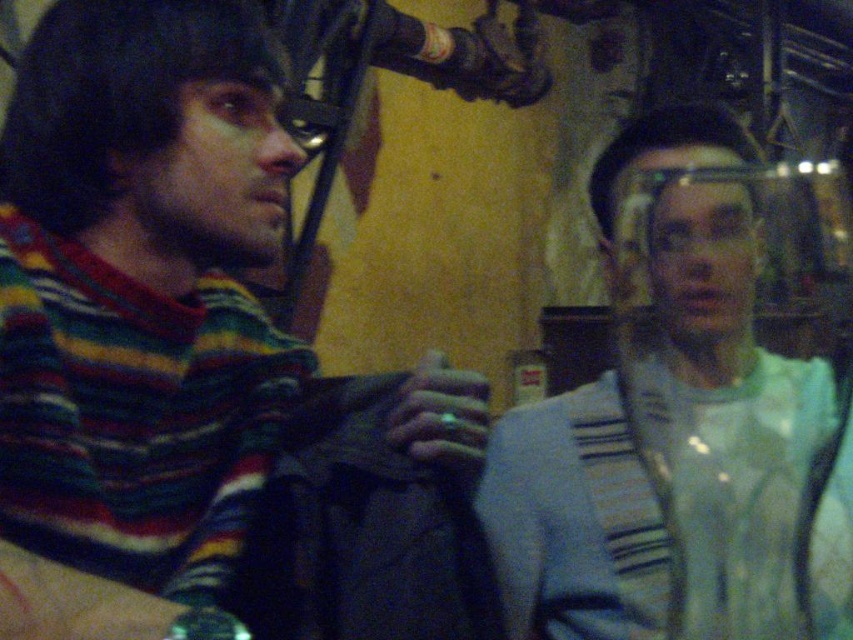
Question: Is striped wool sweater at left below light blue fabric at right?

Choices:
 (A) yes
 (B) no

Answer: (B)

Question: Is striped wool sweater at left positioned before light blue fabric at right?

Choices:
 (A) yes
 (B) no

Answer: (B)

Question: Which point appears closest to the camera in this image?

Choices:
 (A) (509, 429)
 (B) (316, 525)

Answer: (B)

Question: Among these points, which one is nearest to the camera?

Choices:
 (A) (622, 394)
 (B) (216, 397)

Answer: (B)

Question: Does striped wool sweater at left appear on the left side of light blue fabric at right?

Choices:
 (A) yes
 (B) no

Answer: (A)

Question: Which object appears farthest from the camera in this image?

Choices:
 (A) striped wool sweater at left
 (B) light blue fabric at right

Answer: (A)